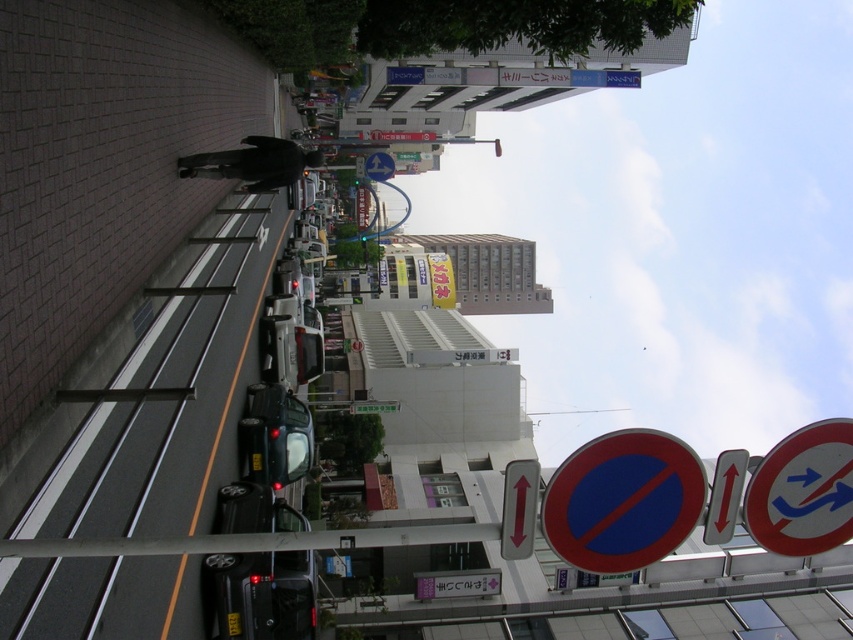
You are a delivery driver who needs to park your vehicle on this street. The parking spot you want is near the smooth plastic circle at center. According to the traffic signs, is parking allowed there?

The smooth plastic circle at center is located at point (624, 500), which is near the traffic sign with a red circle and blue center indicating no parking. Therefore, parking is not allowed there.

You are a city planner reviewing the traffic signs on an urban street. You notice two signs at the center of the pole. Which of the two, the smooth plastic circle at center or the matte blue arrow at center, is smaller in size?

The smooth plastic circle at center is smaller in size than the matte blue arrow at center because it occupies less space.